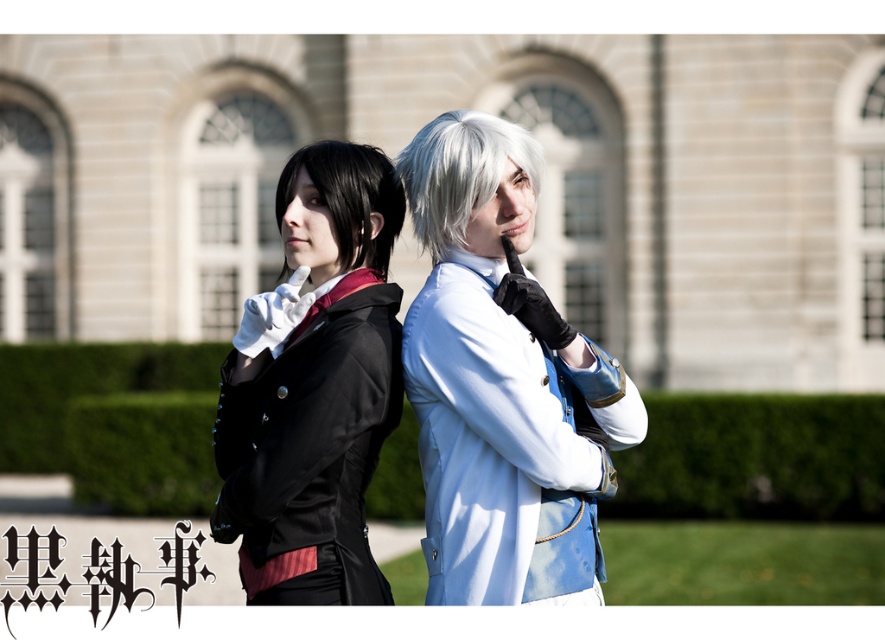
You are a photographer standing at a certain distance from the scene. You want to capture a closeup shot of the satin white wig at center. Based on the description, is the current distance suitable for a closeup shot?

The satin white wig at center is 39.71 meters away from the viewer. A closeup shot typically requires a much closer distance, so the current distance is not suitable for capturing a closeup.

You are a photographer setting up a shoot for two models. You notice the satin white wig at center and the shiny black hair at left. Which object is closer to the camera lens based on their positions?

The satin white wig at center is closer to the camera lens because it is positioned in front of the shiny black hair at left.